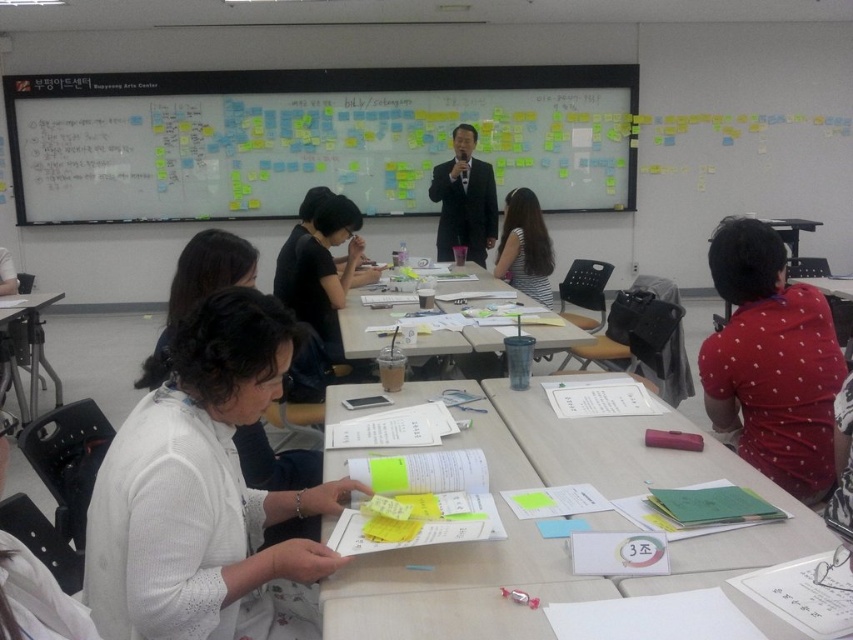
Question: From the image, what is the correct spatial relationship of red dotted shirt at right in relation to clear plastic cup at center?

Choices:
 (A) right
 (B) left

Answer: (A)

Question: Does clear plastic cup at center appear on the right side of striped fabric shirt at center?

Choices:
 (A) no
 (B) yes

Answer: (A)

Question: Which point is farther from the camera taking this photo?

Choices:
 (A) (780, 467)
 (B) (35, 364)

Answer: (B)

Question: Which point is farther to the camera?

Choices:
 (A) (711, 474)
 (B) (22, 410)
 (C) (294, 301)

Answer: (B)

Question: Is white paper at center below red dotted shirt at right?

Choices:
 (A) yes
 (B) no

Answer: (A)

Question: Which point is farther to the camera?

Choices:
 (A) striped fabric shirt at center
 (B) satin black suit at center

Answer: (B)